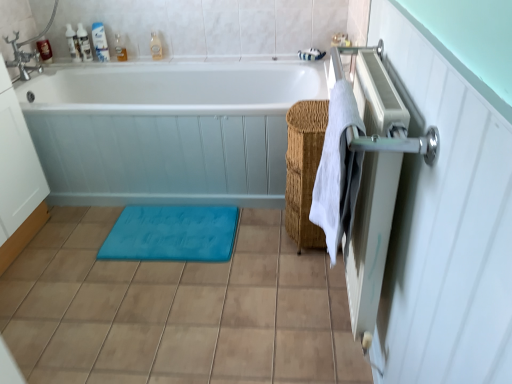
The image size is (512, 384). I want to click on unoccupied region to the right of translucent plastic soap at upper left, which is the 1th toiletry from left to right, so click(69, 57).